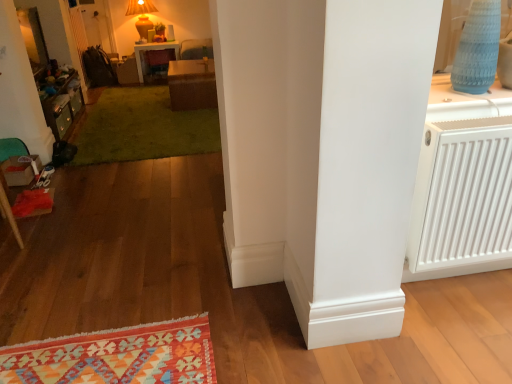
Question: Which is correct: brown woven table at center, which is the first table in right-to-left order, is inside matte yellow lamp at upper center, or outside of it?

Choices:
 (A) outside
 (B) inside

Answer: (A)

Question: Is point (189, 94) closer or farther from the camera than point (151, 24)?

Choices:
 (A) farther
 (B) closer

Answer: (B)

Question: Estimate the real-world distances between objects in this image. Which object is closer to the wooden dresser at left?

Choices:
 (A) white plastic radiator at right
 (B) matte yellow lamp at upper center
 (C) green plush rug at center
 (D) matte white table at upper center, which ranks as the first table in left-to-right order
 (E) velvet red armchair at center

Answer: (C)

Question: Which object is the farthest from the matte yellow lamp at upper center?

Choices:
 (A) matte white table at upper center, the 2th table in the bottom-to-top sequence
 (B) velvet red armchair at center
 (C) wooden dresser at left
 (D) brown woven table at center, which is the first table in right-to-left order
 (E) green plush rug at center

Answer: (E)